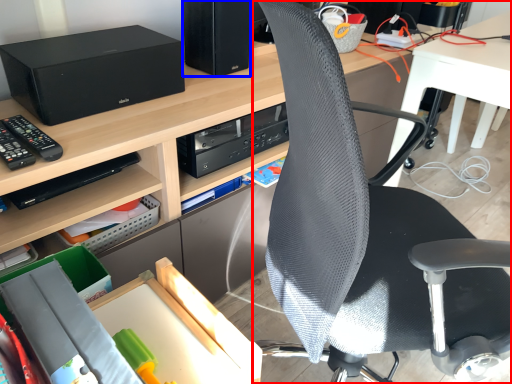
Question: Which of the following is the closest to the observer, chair (highlighted by a red box) or computer tower (highlighted by a blue box)?

Choices:
 (A) chair
 (B) computer tower

Answer: (A)